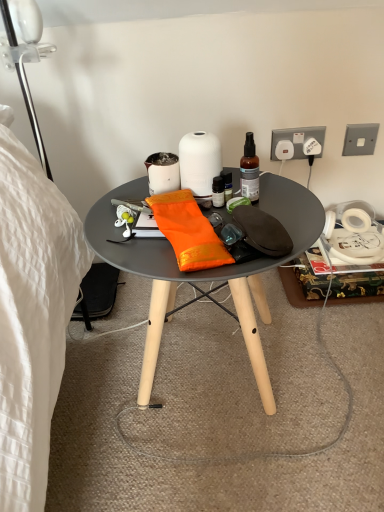
Where is `free point above matte black table at center (from a real-world perspective)`? The height and width of the screenshot is (512, 384). free point above matte black table at center (from a real-world perspective) is located at coordinates click(194, 213).